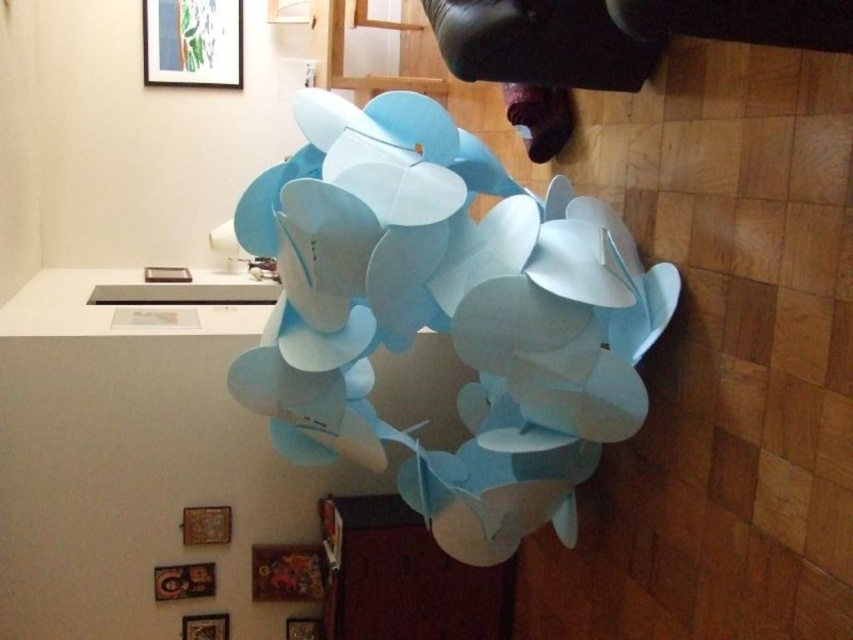
Between light blue paper at center and matte white frame at upper center, which one appears on the right side from the viewer's perspective?

light blue paper at center

Which of these two, light blue paper at center or matte white frame at upper center, stands taller?

With more height is light blue paper at center.

Which is in front, point (283, 444) or point (170, 273)?

Point (283, 444)

At what (x,y) coordinates should I click in order to perform the action: click on light blue paper at center. Please return your answer as a coordinate pair (x, y). This screenshot has height=640, width=853. Looking at the image, I should click on (445, 314).